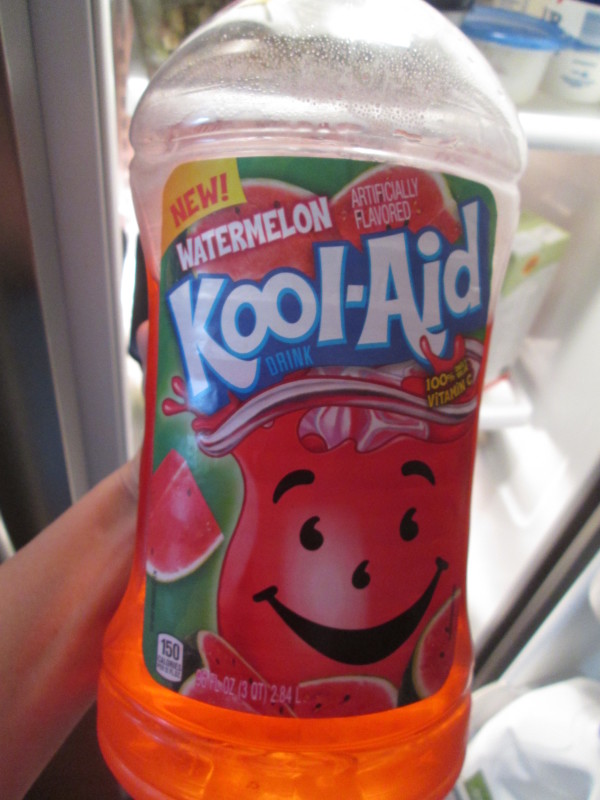
At what (x,y) coordinates should I click in order to perform the action: click on shelf of refrigerator. Please return your answer as a coordinate pair (x, y). Looking at the image, I should click on [x=552, y=106], [x=501, y=401].